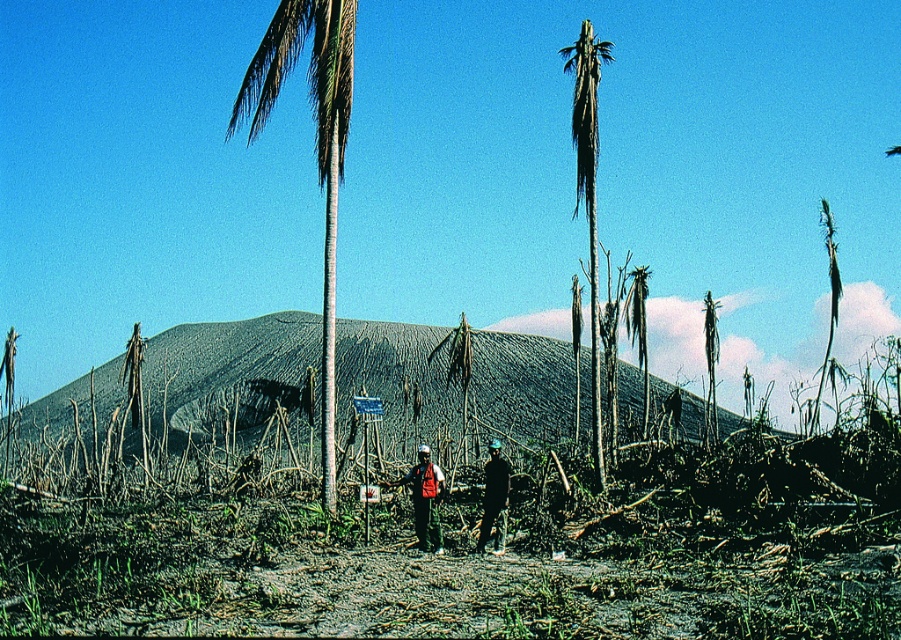
Question: Which of these objects is positioned closest to the green leafy palm tree at center?

Choices:
 (A) red reflective vest at center
 (B) dark blue fabric at center
 (C) white smooth palm tree at center

Answer: (B)

Question: Which of these objects is positioned farthest from the red reflective vest at center?

Choices:
 (A) green leafy palm tree at center
 (B) dark blue fabric at center

Answer: (A)

Question: Can you confirm if green leafy palm tree at center is positioned to the right of dark blue fabric at center?

Choices:
 (A) yes
 (B) no

Answer: (A)

Question: Can you confirm if green leafy palm tree at center is positioned to the right of red reflective vest at center?

Choices:
 (A) no
 (B) yes

Answer: (B)

Question: Estimate the real-world distances between objects in this image. Which object is farther from the dark blue fabric at center?

Choices:
 (A) red reflective vest at center
 (B) white smooth palm tree at center

Answer: (B)

Question: Is white smooth palm tree at center closer to camera compared to green leafy palm tree at center?

Choices:
 (A) no
 (B) yes

Answer: (B)